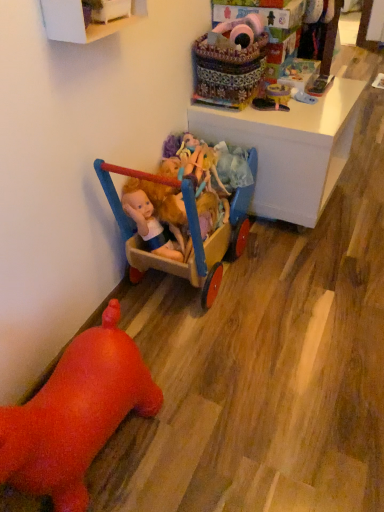
At what (x,y) coordinates should I click in order to perform the action: click on vacant area that is in front of matte plastic toy at upper center, which is the 5th toy from bottom to top. Please return your answer as a coordinate pair (x, y). The width and height of the screenshot is (384, 512). Looking at the image, I should click on (294, 115).